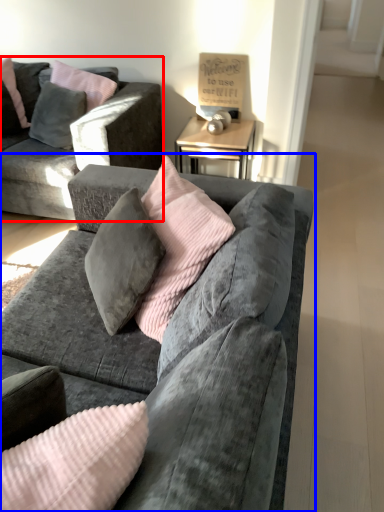
Question: Which of the following is the farthest to the observer, studio couch (highlighted by a red box) or studio couch (highlighted by a blue box)?

Choices:
 (A) studio couch
 (B) studio couch

Answer: (A)